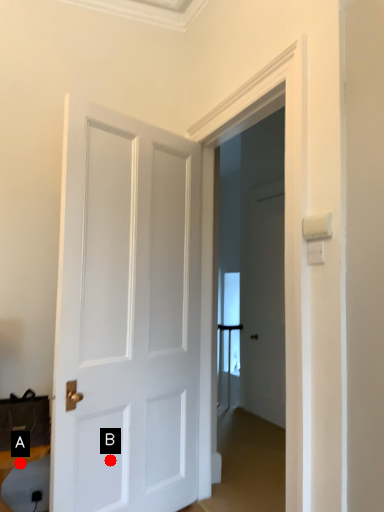
Question: Two points are circled on the image, labeled by A and B beside each circle. Which of the following is the closest to the observer?

Choices:
 (A) A is closer
 (B) B is closer

Answer: (A)